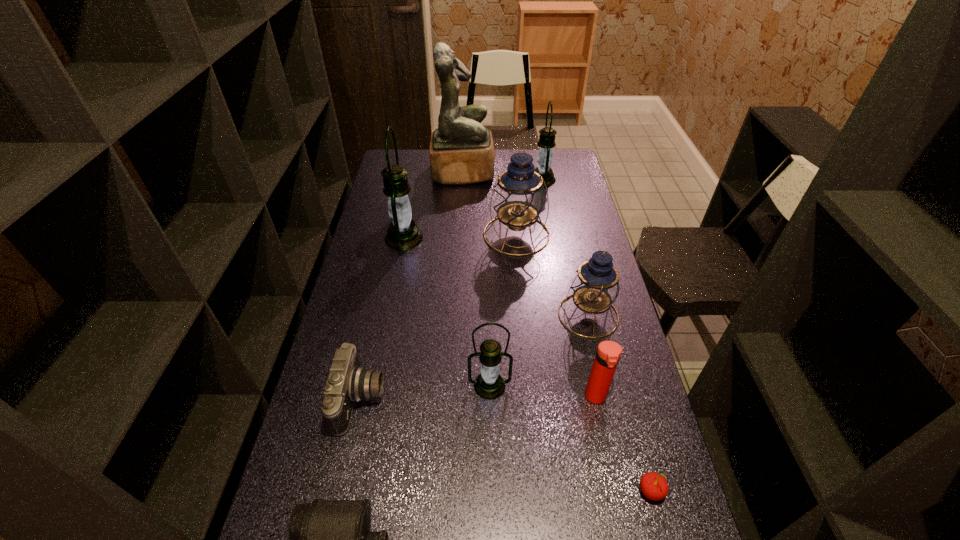
This screenshot has height=540, width=960. I want to click on the tallest object, so 461,151.

In order to click on the leftmost lantern in this screenshot , I will do `click(403, 234)`.

The width and height of the screenshot is (960, 540). I want to click on the leftmost green lantern, so click(x=403, y=234).

This screenshot has height=540, width=960. Find the location of `the farthest green lantern`. the farthest green lantern is located at coordinates (546, 142).

Identify the location of the farthest lantern. (546, 142).

Where is `the bigger blue lantern`? the bigger blue lantern is located at coordinates (519, 196).

The width and height of the screenshot is (960, 540). Find the location of `the nearest lantern`. the nearest lantern is located at coordinates (489, 385).

Find the location of a particular element. the smallest green lantern is located at coordinates (489, 385).

Where is `the smaller blue lantern`? This screenshot has width=960, height=540. the smaller blue lantern is located at coordinates (595, 287).

What are the coordinates of `the nearer blue lantern` in the screenshot? It's located at (595, 287).